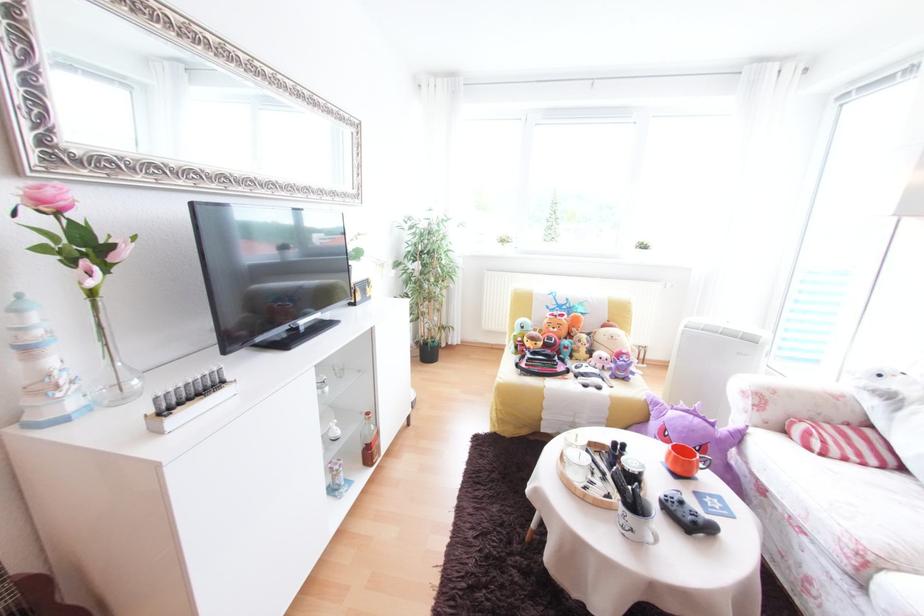
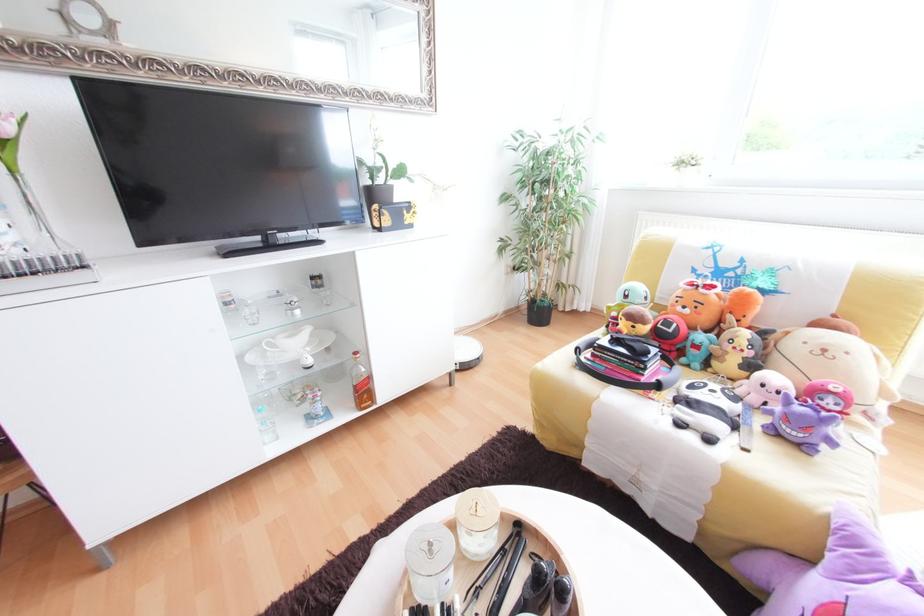
Where in the second image is the point corresponding to (570,315) from the first image?

(719, 288)